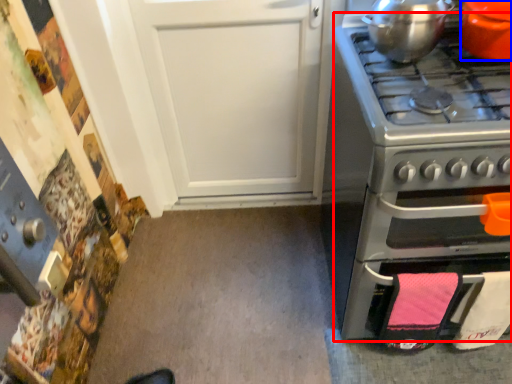
Question: Which object is further to the camera taking this photo, oven (highlighted by a red box) or kitchen appliance (highlighted by a blue box)?

Choices:
 (A) oven
 (B) kitchen appliance

Answer: (B)